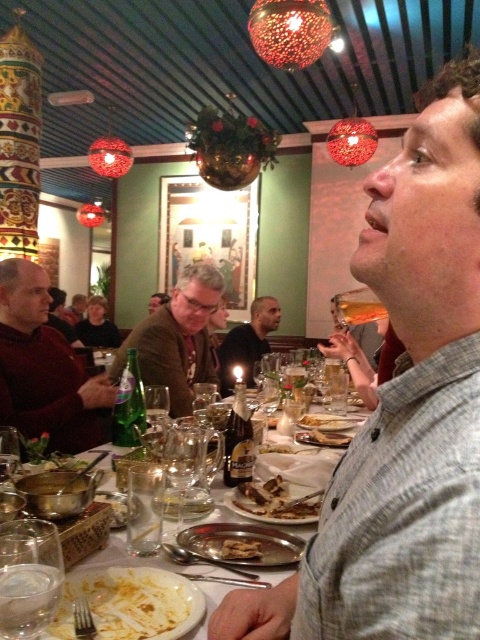
Is metallic silver plate at center below golden crispy chicken at center?

No.

Does metallic silver plate at center appear on the left side of golden crispy chicken at center?

Yes, metallic silver plate at center is to the left of golden crispy chicken at center.

Image resolution: width=480 pixels, height=640 pixels. Find the location of `metallic silver plate at center`. metallic silver plate at center is located at coordinates (300, 467).

Which is in front, point (429, 225) or point (158, 333)?

Point (429, 225) is more forward.

Can you confirm if gray textured shirt at center is thinner than brown textured sweater at center?

Correct, gray textured shirt at center's width is less than brown textured sweater at center's.

You are a GUI agent. You are given a task and a screenshot of the screen. Output one action in this format:
    pyautogui.click(x=<x>, y=<y>)
    Task: Click on the gray textured shirt at center
    The height and width of the screenshot is (640, 480).
    Given the screenshot: What is the action you would take?
    pyautogui.click(x=404, y=412)

Locate an element on the screen. gray textured shirt at center is located at coordinates (404, 412).

Is clear glass at table left taller than matte brown jacket at center?

No, clear glass at table left is not taller than matte brown jacket at center.

Can you confirm if clear glass at table left is smaller than matte brown jacket at center?

Correct, clear glass at table left occupies less space than matte brown jacket at center.

Describe the element at coordinates (28, 577) in the screenshot. I see `clear glass at table left` at that location.

Image resolution: width=480 pixels, height=640 pixels. Find the location of `clear glass at table left`. clear glass at table left is located at coordinates (28, 577).